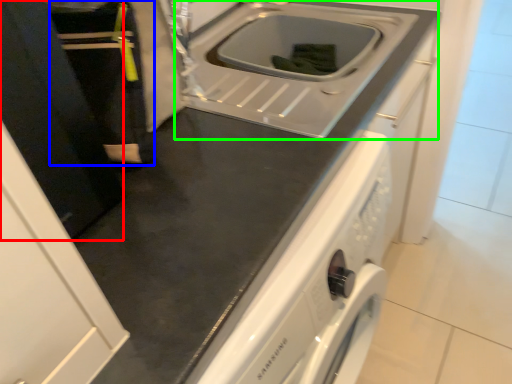
Question: Which object is positioned farthest from door (highlighted by a red box)? Select from person (highlighted by a blue box) and sink (highlighted by a green box).

Choices:
 (A) person
 (B) sink

Answer: (B)